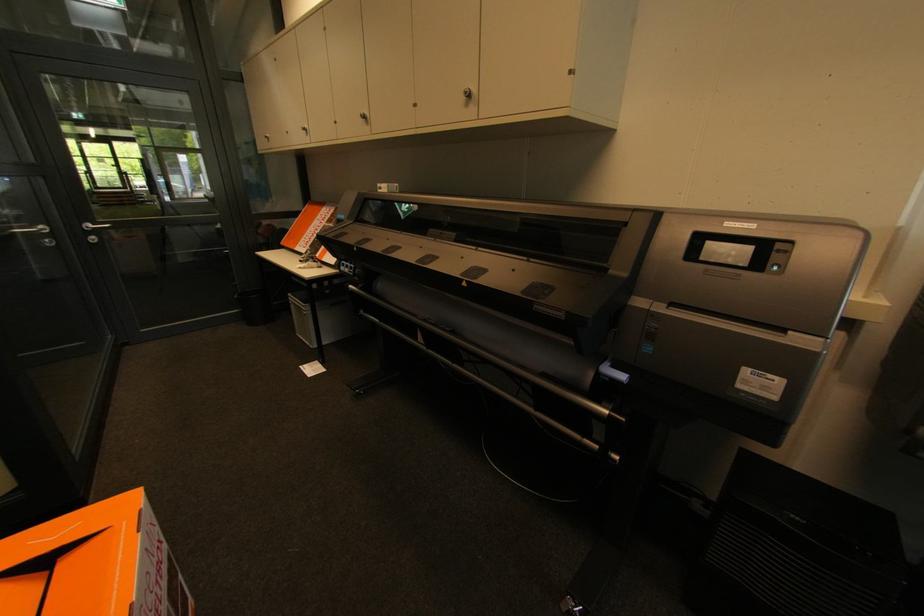
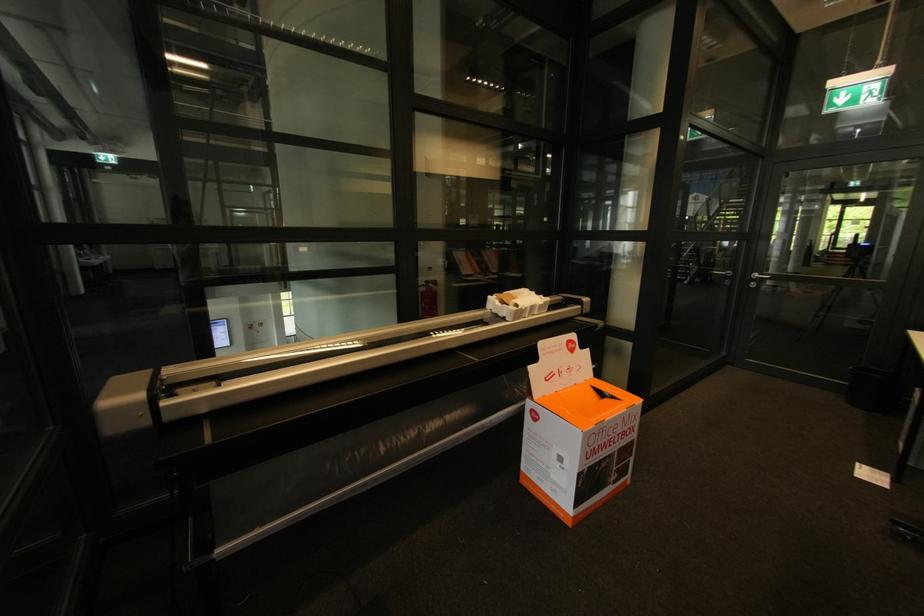
Question: The camera is either moving clockwise (left) or counter-clockwise (right) around the object. The first image is from the beginning of the video and the second image is from the end. Is the camera moving left or right when shooting the video?

Choices:
 (A) Left
 (B) Right

Answer: (B)